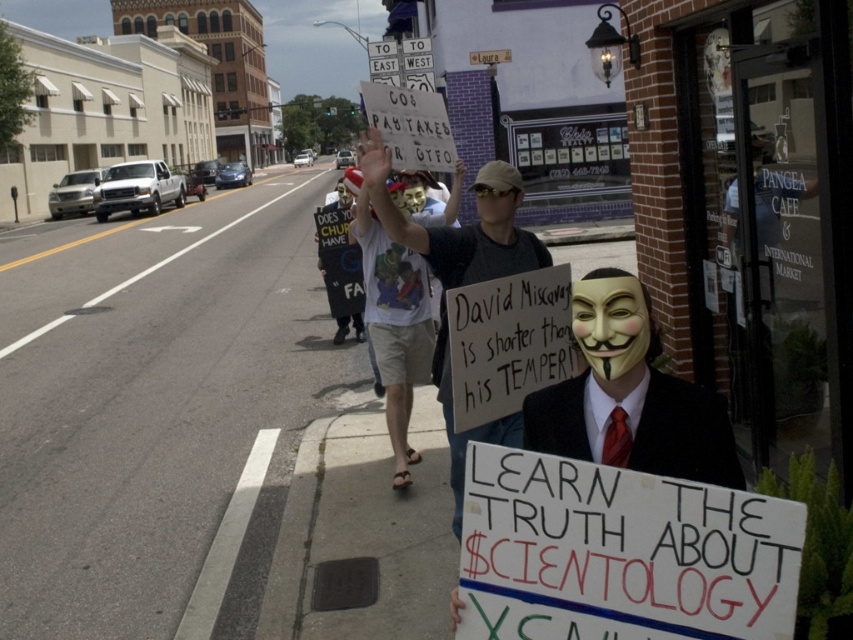
Question: Is white cardboard sign at lower center further to camera compared to white t-shirt at center?

Choices:
 (A) no
 (B) yes

Answer: (A)

Question: Which point is closer to the camera?

Choices:
 (A) white t-shirt at center
 (B) white cardboard sign at lower center

Answer: (B)

Question: Is white cardboard sign at lower center closer to the viewer compared to white t-shirt at center?

Choices:
 (A) yes
 (B) no

Answer: (A)

Question: Does white cardboard sign at lower center appear on the right side of white t-shirt at center?

Choices:
 (A) no
 (B) yes

Answer: (B)